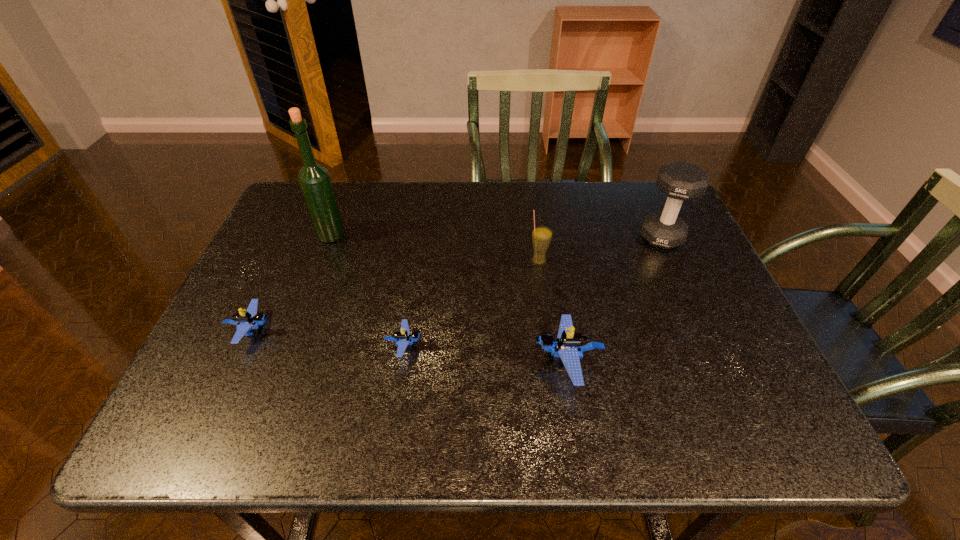
The height and width of the screenshot is (540, 960). In order to click on the second tallest Lego in this screenshot , I will do `click(251, 319)`.

This screenshot has width=960, height=540. Identify the location of the fifth tallest object. (251, 319).

I want to click on the third object from left to right, so click(402, 338).

The height and width of the screenshot is (540, 960). In order to click on the second Lego from left to right in this screenshot , I will do `click(402, 338)`.

This screenshot has height=540, width=960. Identify the location of the fourth tallest object. (569, 345).

Locate an element on the screen. The image size is (960, 540). the rightmost Lego is located at coordinates (569, 345).

Image resolution: width=960 pixels, height=540 pixels. Find the location of `the rightmost object`. the rightmost object is located at coordinates (680, 181).

You are a GUI agent. You are given a task and a screenshot of the screen. Output one action in this format:
    pyautogui.click(x=<x>, y=<y>)
    Task: Click on the second tallest object
    
    Given the screenshot: What is the action you would take?
    pyautogui.click(x=680, y=181)

Where is `the fourth shortest object`? This screenshot has height=540, width=960. the fourth shortest object is located at coordinates (541, 236).

Locate an element on the screen. The width and height of the screenshot is (960, 540). straw for drinking is located at coordinates (541, 236).